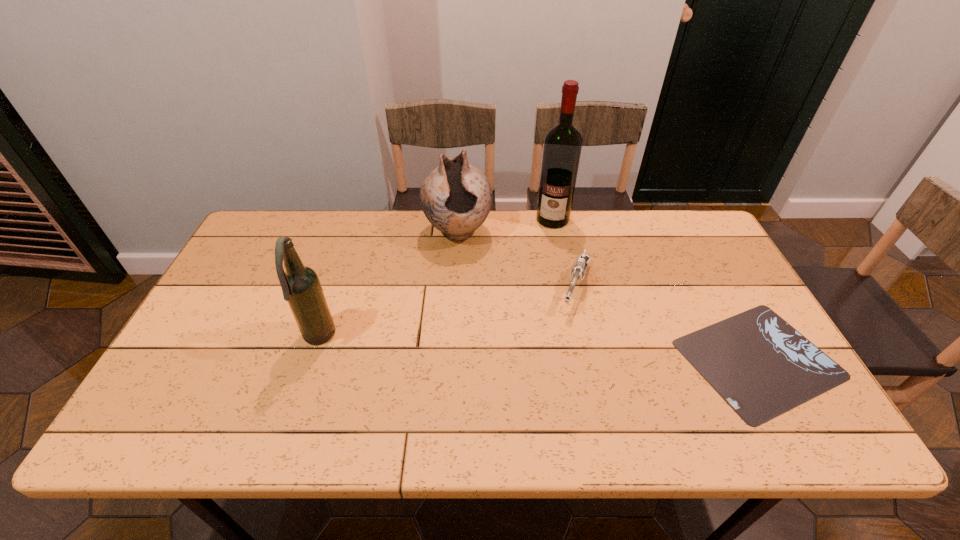
Locate an element on the screen. vacant point located on the front and back of the alcohol is located at coordinates (529, 306).

This screenshot has height=540, width=960. I want to click on vacant space positioned aimed along the barrel of the gun, so click(551, 379).

The image size is (960, 540). I want to click on vacant space situated aimed along the barrel of the gun, so click(x=559, y=356).

Locate an element on the screen. The width and height of the screenshot is (960, 540). vacant space situated aimed along the barrel of the gun is located at coordinates (557, 362).

Find the location of a particular element. vacant position located from the spout of the second object from left to right is located at coordinates (475, 342).

What are the coordinates of `free space located from the spout of the second object from left to right` in the screenshot? It's located at (463, 265).

Find the location of `free space located 0.370m from the spout of the second object from left to right`. free space located 0.370m from the spout of the second object from left to right is located at coordinates (476, 349).

At what (x,y) coordinates should I click in order to perform the action: click on alcohol at the far edge. Please return your answer as a coordinate pair (x, y). The image size is (960, 540). Looking at the image, I should click on (562, 147).

The width and height of the screenshot is (960, 540). Find the location of `pottery that is at the far edge`. pottery that is at the far edge is located at coordinates (456, 198).

You are a GUI agent. You are given a task and a screenshot of the screen. Output one action in this format:
    pyautogui.click(x=<x>, y=<y>)
    Task: Click on the object that is positioned at the near edge
    
    Given the screenshot: What is the action you would take?
    pyautogui.click(x=758, y=363)